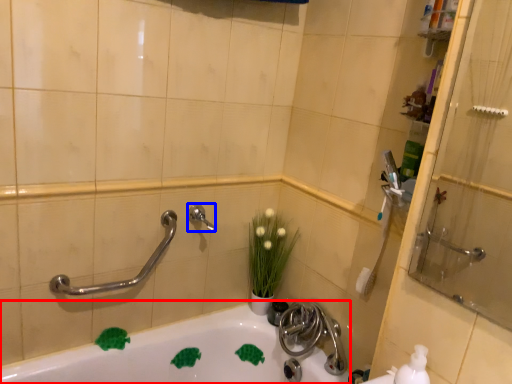
Question: Which object appears farthest to the camera in this image, bathtub (highlighted by a red box) or plumbing fixture (highlighted by a blue box)?

Choices:
 (A) bathtub
 (B) plumbing fixture

Answer: (B)